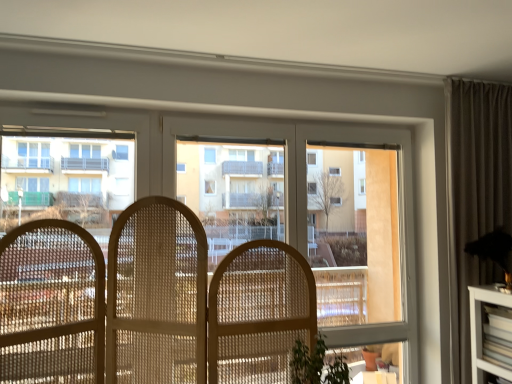
Question: Would you say transparent glass window at center is inside or outside transparent glass bay window at center?

Choices:
 (A) outside
 (B) inside

Answer: (A)

Question: From the image's perspective, is transparent glass window at center located above or below transparent glass bay window at center?

Choices:
 (A) above
 (B) below

Answer: (B)

Question: Which object is the farthest from the transparent glass window at center?

Choices:
 (A) white glossy building at left
 (B) transparent glass bay window at center

Answer: (B)

Question: Which is nearer to the transparent glass window at center?

Choices:
 (A) transparent glass bay window at center
 (B) white glossy building at left

Answer: (B)